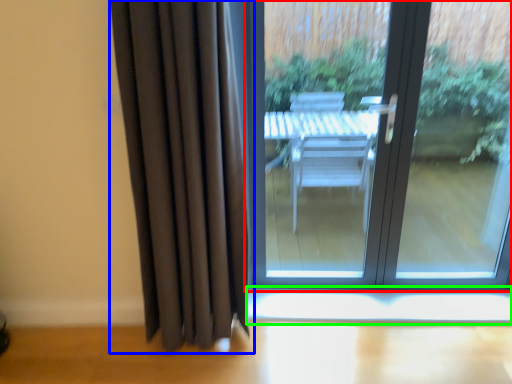
Question: Considering the real-world distances, which object is closest to door (highlighted by a red box)? curtain (highlighted by a blue box) or window sill (highlighted by a green box).

Choices:
 (A) curtain
 (B) window sill

Answer: (B)